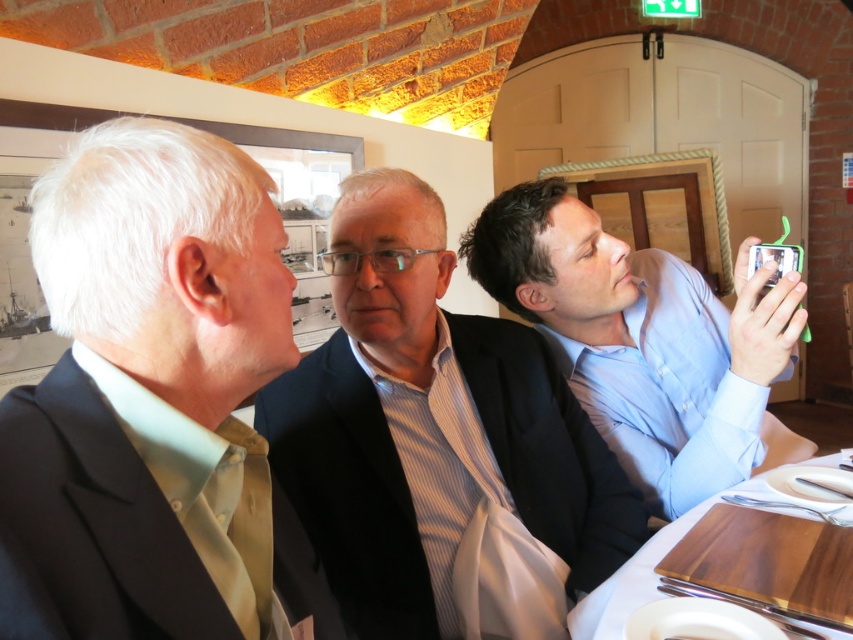
Question: Estimate the real-world distances between objects in this image. Which object is closer to the blue shirt at right?

Choices:
 (A) wooden cutting board at lower right
 (B) dark blue suit at center

Answer: (B)

Question: Is blue shirt at right to the left of wooden cutting board at lower right from the viewer's perspective?

Choices:
 (A) no
 (B) yes

Answer: (A)

Question: Is dark blue suit at center smaller than wooden cutting board at lower right?

Choices:
 (A) no
 (B) yes

Answer: (A)

Question: From the image, what is the correct spatial relationship of dark blue suit at center in relation to blue shirt at right?

Choices:
 (A) below
 (B) above

Answer: (A)

Question: Which point appears farthest from the camera in this image?

Choices:
 (A) (460, 440)
 (B) (91, 481)
 (C) (677, 524)

Answer: (C)

Question: Which object is farther from the camera taking this photo?

Choices:
 (A) dark blue suit at center
 (B) wooden cutting board at lower right
 (C) light beige suit at center
 (D) blue shirt at right

Answer: (D)